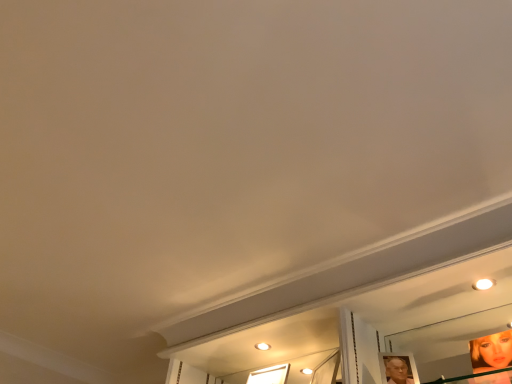
Question: From a real-world perspective, is shiny gold mirror at lower right on top of transparent glass window at center?

Choices:
 (A) no
 (B) yes

Answer: (A)

Question: From the image's perspective, is shiny gold mirror at lower right located beneath transparent glass window at center?

Choices:
 (A) no
 (B) yes

Answer: (A)

Question: Is shiny gold mirror at lower right outside transparent glass window at center?

Choices:
 (A) no
 (B) yes

Answer: (B)

Question: Is shiny gold mirror at lower right looking in the opposite direction of transparent glass window at center?

Choices:
 (A) no
 (B) yes

Answer: (A)

Question: Can you confirm if shiny gold mirror at lower right is taller than transparent glass window at center?

Choices:
 (A) yes
 (B) no

Answer: (A)

Question: Can you confirm if shiny gold mirror at lower right is shorter than transparent glass window at center?

Choices:
 (A) yes
 (B) no

Answer: (B)

Question: Is transparent glass window at center to the right of shiny gold mirror at lower right from the viewer's perspective?

Choices:
 (A) no
 (B) yes

Answer: (A)

Question: Can you confirm if transparent glass window at center is thinner than shiny gold mirror at lower right?

Choices:
 (A) no
 (B) yes

Answer: (A)

Question: Considering the relative sizes of transparent glass window at center and shiny gold mirror at lower right in the image provided, is transparent glass window at center wider than shiny gold mirror at lower right?

Choices:
 (A) yes
 (B) no

Answer: (A)

Question: Does transparent glass window at center have a lesser height compared to shiny gold mirror at lower right?

Choices:
 (A) yes
 (B) no

Answer: (A)

Question: Is transparent glass window at center bigger than shiny gold mirror at lower right?

Choices:
 (A) no
 (B) yes

Answer: (A)

Question: Is transparent glass window at center positioned beyond the bounds of shiny gold mirror at lower right?

Choices:
 (A) yes
 (B) no

Answer: (A)

Question: From their relative heights in the image, would you say shiny gold mirror at lower right is taller or shorter than transparent glass window at center?

Choices:
 (A) tall
 (B) short

Answer: (A)